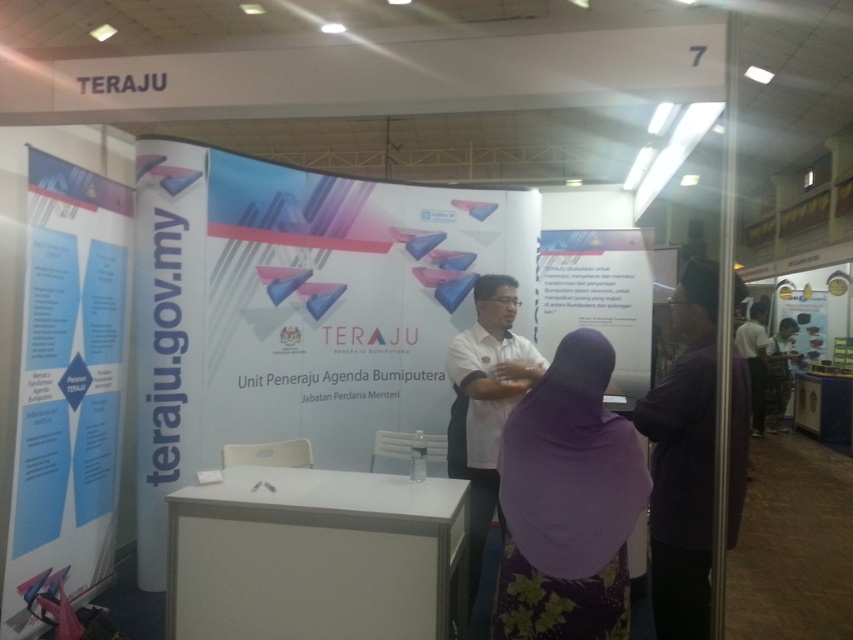
Find the location of a particular element. white paper at left is located at coordinates (68, 385).

Is white paper at left to the left of white shirt at center from the viewer's perspective?

Indeed, white paper at left is positioned on the left side of white shirt at center.

Where is `white paper at left`? white paper at left is located at coordinates (68, 385).

Can you confirm if purple fabric headscarf at center is positioned to the right of white glossy poster at upper right?

No, purple fabric headscarf at center is not to the right of white glossy poster at upper right.

Where is `purple fabric headscarf at center`? purple fabric headscarf at center is located at coordinates (567, 502).

Is white shirt at center behind white glossy shirt at right?

No.

Does white shirt at center appear on the left side of white glossy shirt at right?

Indeed, white shirt at center is positioned on the left side of white glossy shirt at right.

I want to click on white shirt at center, so click(x=485, y=403).